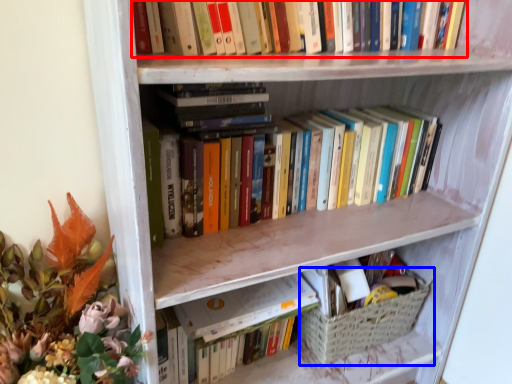
Question: Which object is closer to the camera taking this photo, book (highlighted by a red box) or basket (highlighted by a blue box)?

Choices:
 (A) book
 (B) basket

Answer: (A)